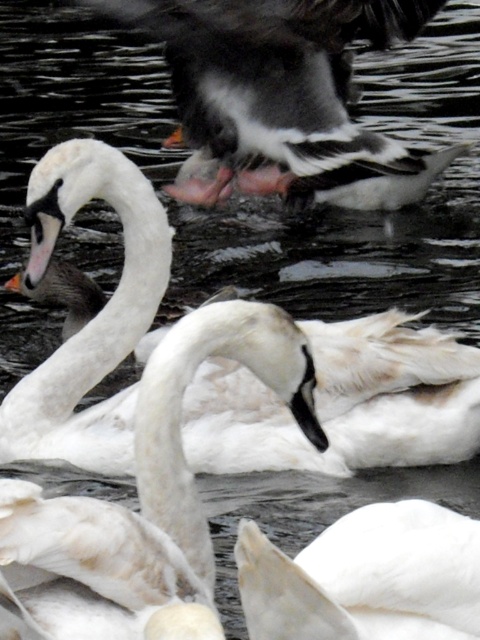
What do you see at coordinates (344, 403) in the screenshot? I see `white feathered swan at upper left` at bounding box center [344, 403].

Can you confirm if white feathered swan at upper left is bigger than white feathered swan at center?

Yes.

This screenshot has width=480, height=640. What do you see at coordinates (344, 403) in the screenshot?
I see `white feathered swan at upper left` at bounding box center [344, 403].

The width and height of the screenshot is (480, 640). I want to click on white feathered swan at upper left, so click(x=344, y=403).

Who is more forward, (297,33) or (423,568)?

Point (423,568)

Who is more forward, [206,22] or [334,611]?

Point [334,611] is more forward.

In order to click on black glossy duck at upper center in this screenshot , I will do `click(282, 97)`.

Is white matte swan at center taller than white feathered swan at center?

Yes.

Consider the image. Does white matte swan at center appear on the right side of white feathered swan at center?

Incorrect, white matte swan at center is not on the right side of white feathered swan at center.

Is point (66, 516) farther from viewer compared to point (322, 634)?

Yes, it is.

Locate an element on the screen. The width and height of the screenshot is (480, 640). white matte swan at center is located at coordinates (143, 493).